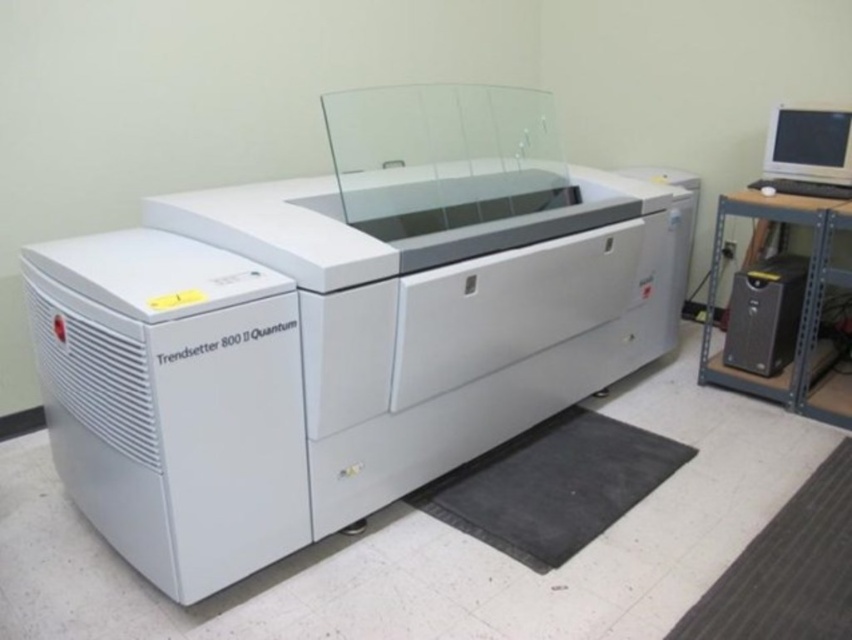
Question: Is black rubber mat at lower right positioned behind matte gray monitor at upper right?

Choices:
 (A) yes
 (B) no

Answer: (B)

Question: Considering the real-world distances, which object is closest to the black rubber mat at lower right?

Choices:
 (A) black rubber mat at lower center
 (B) matte gray monitor at upper right
 (C) white glossy printer at center
 (D) black plastic computer tower at right

Answer: (A)

Question: Considering the relative positions of white glossy printer at center and black rubber mat at lower right in the image provided, where is white glossy printer at center located with respect to black rubber mat at lower right?

Choices:
 (A) above
 (B) below

Answer: (A)

Question: Estimate the real-world distances between objects in this image. Which object is closer to the black rubber mat at lower center?

Choices:
 (A) black rubber mat at lower right
 (B) matte gray monitor at upper right
 (C) black plastic computer tower at right
 (D) white glossy printer at center

Answer: (D)

Question: Which object is the closest to the black rubber mat at lower center?

Choices:
 (A) black plastic computer tower at right
 (B) matte gray monitor at upper right
 (C) black rubber mat at lower right

Answer: (C)

Question: Is black rubber mat at lower center below matte gray monitor at upper right?

Choices:
 (A) no
 (B) yes

Answer: (B)